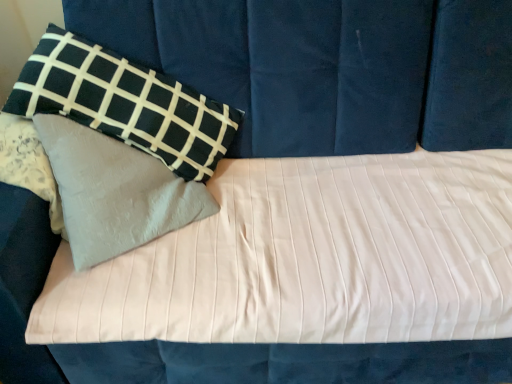
This screenshot has height=384, width=512. Describe the element at coordinates (125, 103) in the screenshot. I see `black checkered pillow at left` at that location.

Find the location of a particular element. This screenshot has width=512, height=384. black checkered pillow at left is located at coordinates (125, 103).

Measure the distance between point (228, 143) and camera.

Point (228, 143) is 1.20 meters from camera.

Image resolution: width=512 pixels, height=384 pixels. Identify the location of black checkered pillow at left. (125, 103).